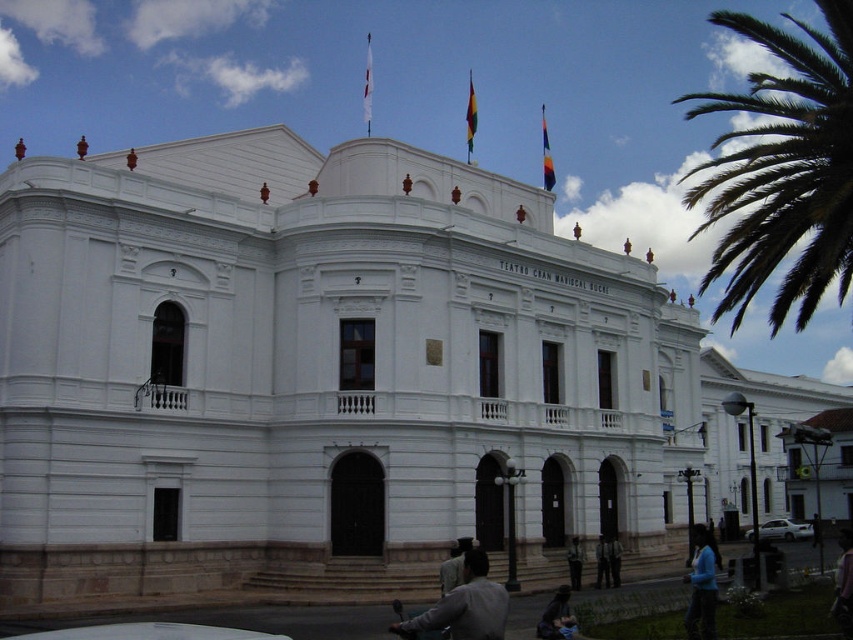
You are standing at the entrance of the TEATRO building and see a person wearing dark blue jeans at lower center and another wearing dark blue uniform at center. Which person is closer to you?

The dark blue jeans at lower center is closer to you because it is in front of the dark blue uniform at center.

You are standing in front of the TEATRO building and notice two points marked on its facade. The first point is at coordinate (602, 547) and the second is at (610, 572). Which of these points is closer to you?

Point (602, 547) is closer to you because it is further to the viewer than point (610, 572).